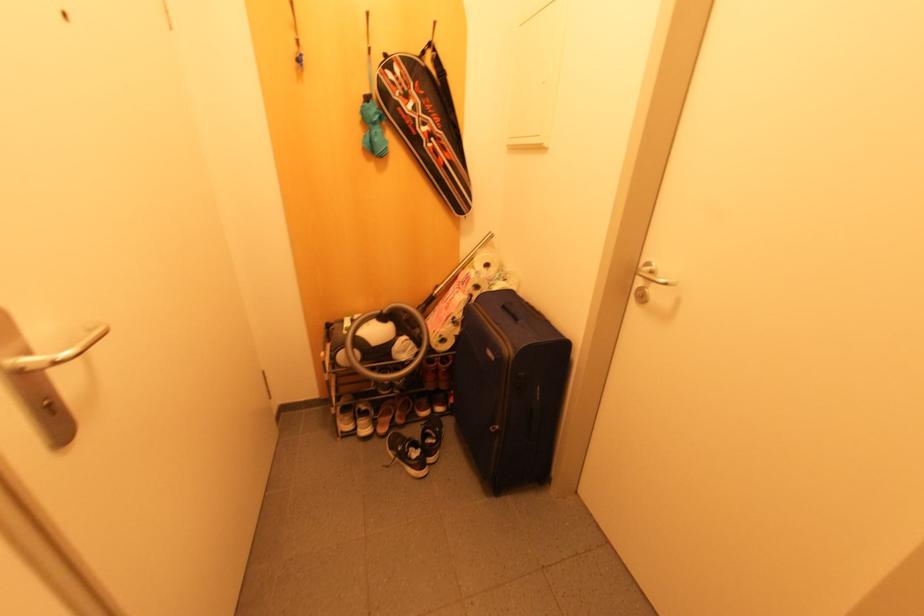
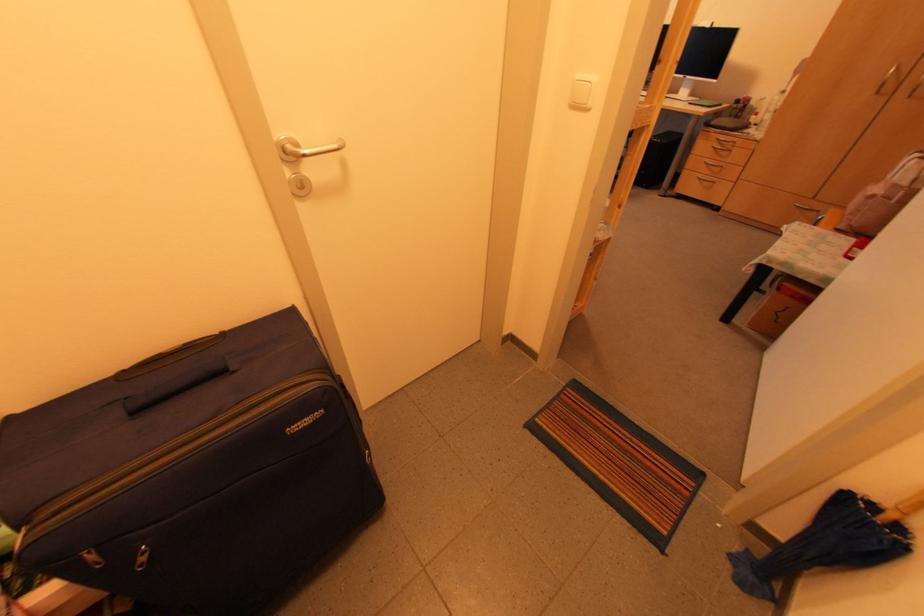
In the second image, find the point that corresponds to pixel 503 307 in the first image.

(134, 413)